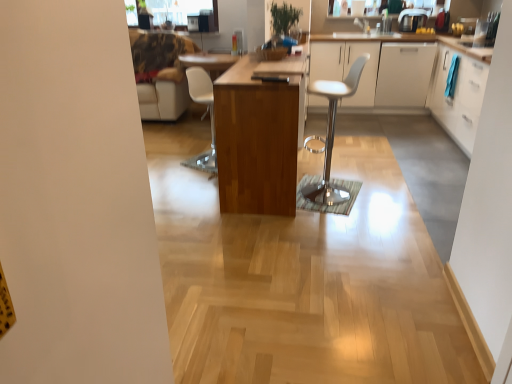
The image size is (512, 384). What do you see at coordinates (168, 10) in the screenshot?
I see `transparent glass window screen at upper center` at bounding box center [168, 10].

Locate an element on the screen. Image resolution: width=512 pixels, height=384 pixels. transparent glass window screen at upper center is located at coordinates (168, 10).

Find the location of a particular element. The image size is (512, 384). white glossy cabinet at upper right, which is the first cabinetry from left to right is located at coordinates (378, 70).

Locate an element on the screen. white matte cabinet at right, which appears as the 3th cabinetry when viewed from the left is located at coordinates (404, 74).

Locate an element on the screen. The image size is (512, 384). wooden table at center is located at coordinates (257, 140).

Where is `velvet brown couch at upper left`? This screenshot has height=384, width=512. velvet brown couch at upper left is located at coordinates (161, 73).

Can you confirm if white matte cabinet at right, placed as the 2th cabinetry when sorted from right to left, is thinner than transparent glass window screen at upper center?

Incorrect, the width of white matte cabinet at right, placed as the 2th cabinetry when sorted from right to left, is not less than that of transparent glass window screen at upper center.

Would you say white matte cabinet at right, placed as the 2th cabinetry when sorted from right to left, is inside or outside transparent glass window screen at upper center?

white matte cabinet at right, placed as the 2th cabinetry when sorted from right to left, is not inside transparent glass window screen at upper center, it's outside.

Where is `window screen on the left of the white matte cabinet at right, which appears as the 3th cabinetry when viewed from the left`? Image resolution: width=512 pixels, height=384 pixels. window screen on the left of the white matte cabinet at right, which appears as the 3th cabinetry when viewed from the left is located at coordinates (168, 10).

From a real-world perspective, relative to transparent glass window screen at upper center, is white matte cabinet at right, placed as the 2th cabinetry when sorted from right to left, vertically above or below?

In terms of real-world spatial position, white matte cabinet at right, placed as the 2th cabinetry when sorted from right to left, is below transparent glass window screen at upper center.

Considering the relative sizes of transparent glass window screen at upper center and wooden table at center in the image provided, is transparent glass window screen at upper center wider than wooden table at center?

Incorrect, the width of transparent glass window screen at upper center does not surpass that of wooden table at center.

Can you confirm if transparent glass window screen at upper center is smaller than wooden table at center?

Yes.

Is point (137, 13) closer to camera compared to point (291, 87)?

No, it is not.

Would you consider wooden table at center to be distant from white matte cabinet at right, which appears as the 3th cabinetry when viewed from the left?

wooden table at center is far away from white matte cabinet at right, which appears as the 3th cabinetry when viewed from the left.

What's the angular difference between wooden table at center and white matte cabinet at right, which appears as the 3th cabinetry when viewed from the left,'s facing directions?

The angular difference between wooden table at center and white matte cabinet at right, which appears as the 3th cabinetry when viewed from the left, is 90.1 degrees.

From the picture: Which object is wider, wooden table at center or white matte cabinet at right, which appears as the 3th cabinetry when viewed from the left?

Wider between the two is white matte cabinet at right, which appears as the 3th cabinetry when viewed from the left.

Who is bigger, wooden table at center or white matte cabinet at right, placed as the 2th cabinetry when sorted from right to left?

With larger size is wooden table at center.

Is point (131, 3) less distant than point (145, 37)?

No.

Does transparent glass window screen at upper center come behind velvet brown couch at upper left?

Yes, transparent glass window screen at upper center is further from the viewer.

Could you tell me if transparent glass window screen at upper center is turned towards velvet brown couch at upper left?

No, transparent glass window screen at upper center does not turn towards velvet brown couch at upper left.

How distant is transparent glass window screen at upper center from velvet brown couch at upper left?

A distance of 23.04 inches exists between transparent glass window screen at upper center and velvet brown couch at upper left.

From the image's perspective, is white glossy cabinet at upper right, which is the third cabinetry from right to left, over transparent glass window screen at upper center?

No.

Is white glossy cabinet at upper right, which is the third cabinetry from right to left, facing away from transparent glass window screen at upper center?

No, white glossy cabinet at upper right, which is the third cabinetry from right to left, is not facing the opposite direction of transparent glass window screen at upper center.

Measure the distance between white glossy cabinet at upper right, which is the third cabinetry from right to left, and transparent glass window screen at upper center.

white glossy cabinet at upper right, which is the third cabinetry from right to left, and transparent glass window screen at upper center are 2.14 meters apart.

From a real-world perspective, is white glossy cabinet at upper right, the 2th cabinetry in the left-to-right sequence, under transparent glass window screen at upper center?

Yes, from a real-world perspective, white glossy cabinet at upper right, the 2th cabinetry in the left-to-right sequence, is beneath transparent glass window screen at upper center.

Considering the positions of objects velvet brown couch at upper left and white glossy cabinet at upper right, the 2th cabinetry in the left-to-right sequence, in the image provided, who is more to the right, velvet brown couch at upper left or white glossy cabinet at upper right, the 2th cabinetry in the left-to-right sequence,?

white glossy cabinet at upper right, the 2th cabinetry in the left-to-right sequence, is more to the right.

Is velvet brown couch at upper left wider or thinner than white glossy cabinet at upper right, which is the third cabinetry from right to left?

Clearly, velvet brown couch at upper left has less width compared to white glossy cabinet at upper right, which is the third cabinetry from right to left.

Is point (153, 103) closer or farther from the camera than point (425, 73)?

Point (153, 103).

From their relative heights in the image, would you say velvet brown couch at upper left is taller or shorter than white glossy cabinet at upper right, the 2th cabinetry in the left-to-right sequence?

In the image, velvet brown couch at upper left appears to be taller than white glossy cabinet at upper right, the 2th cabinetry in the left-to-right sequence.

Between point (343, 55) and point (350, 73), which one is positioned in front?

Point (350, 73)

Considering the relative sizes of white glossy cabinet at upper right, the fourth cabinetry from the right, and white leather stool at center, the 1th chair viewed from the front, in the image provided, is white glossy cabinet at upper right, the fourth cabinetry from the right, smaller than white leather stool at center, the 1th chair viewed from the front,?

Incorrect, white glossy cabinet at upper right, the fourth cabinetry from the right, is not smaller in size than white leather stool at center, the 1th chair viewed from the front.

In the scene shown: Who is shorter, white glossy cabinet at upper right, which is the first cabinetry from left to right, or white leather stool at center, positioned as the second chair in back-to-front order?

white glossy cabinet at upper right, which is the first cabinetry from left to right.

Could you tell me if white glossy cabinet at upper right, the fourth cabinetry from the right, is facing white leather stool at center, positioned as the second chair in back-to-front order?

Yes, white glossy cabinet at upper right, the fourth cabinetry from the right, is oriented towards white leather stool at center, positioned as the second chair in back-to-front order.

Which cabinetry is the 3rd one when counting from the right side of the transparent glass window screen at upper center? Please provide its 2D coordinates.

[(404, 74)]

In the image, there is a wooden table at center. Where is `window screen above it (from the image's perspective)`? window screen above it (from the image's perspective) is located at coordinates (168, 10).

Looking at the image, which one is located further to white glossy cabinet at upper right, which is the third cabinetry from right to left, wooden table at center or velvet brown couch at upper left?

Among the two, velvet brown couch at upper left is located further to white glossy cabinet at upper right, which is the third cabinetry from right to left.

Looking at the image, which one is located further to metallic silver coffee maker at upper right, transparent glass window screen at upper center or white glossy cabinet at right, the 1th cabinetry positioned from the right?

transparent glass window screen at upper center lies further to metallic silver coffee maker at upper right than the other object.

Estimate the real-world distances between objects in this image. Which object is closer to white matte cabinet at right, which appears as the 3th cabinetry when viewed from the left, white plastic chair at center, positioned as the second chair in right-to-left order, or wooden table at center?

Among the two, white plastic chair at center, positioned as the second chair in right-to-left order, is located nearer to white matte cabinet at right, which appears as the 3th cabinetry when viewed from the left.

Which object lies nearer to the anchor point white glossy cabinet at right, the 4th cabinetry when ordered from left to right, velvet brown couch at upper left or white glossy cabinet at upper right, the 2th cabinetry in the left-to-right sequence?

white glossy cabinet at upper right, the 2th cabinetry in the left-to-right sequence.

Based on their spatial positions, is metallic silver coffee maker at upper right or white glossy cabinet at upper right, which is the third cabinetry from right to left, closer to white leather stool at center, arranged as the 2th chair when viewed from the left?

Among the two, white glossy cabinet at upper right, which is the third cabinetry from right to left, is located nearer to white leather stool at center, arranged as the 2th chair when viewed from the left.

From the image, which object appears to be farther from white glossy cabinet at right, the 1th cabinetry positioned from the right, white glossy cabinet at upper right, the fourth cabinetry from the right, or white plastic chair at center, the first chair when ordered from left to right?

white plastic chair at center, the first chair when ordered from left to right, is positioned further to the anchor white glossy cabinet at right, the 1th cabinetry positioned from the right.

When comparing their distances from transparent glass window screen at upper center, does metallic silver coffee maker at upper right or white leather stool at center, the 1th chair viewed from the front, seem closer?

metallic silver coffee maker at upper right lies closer to transparent glass window screen at upper center than the other object.

Which object lies further to the anchor point white plastic chair at center, arranged as the second chair when viewed from the front, white glossy cabinet at upper right, the fourth cabinetry from the right, or white glossy cabinet at upper right, which is the third cabinetry from right to left?

white glossy cabinet at upper right, which is the third cabinetry from right to left, is further to white plastic chair at center, arranged as the second chair when viewed from the front.

The width and height of the screenshot is (512, 384). I want to click on table between velvet brown couch at upper left and white matte cabinet at right, placed as the 2th cabinetry when sorted from right to left, so click(257, 140).

Locate an element on the screen. The height and width of the screenshot is (384, 512). chair between white plastic chair at center, the first chair from the back, and white matte cabinet at right, which appears as the 3th cabinetry when viewed from the left is located at coordinates (331, 133).

Find the location of `cabinetry between transparent glass window screen at upper center and white glossy cabinet at upper right, which is the third cabinetry from right to left, in the horizontal direction`. cabinetry between transparent glass window screen at upper center and white glossy cabinet at upper right, which is the third cabinetry from right to left, in the horizontal direction is located at coordinates (378, 70).

Find the location of a particular element. cabinetry between velvet brown couch at upper left and white glossy cabinet at upper right, which is the third cabinetry from right to left, from left to right is located at coordinates (378, 70).